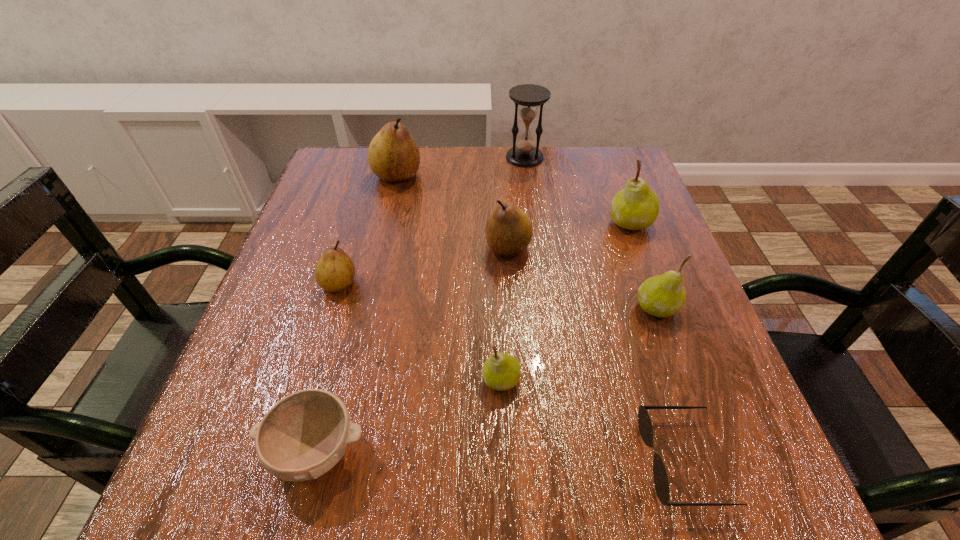
Where is `vacant region located on the right of the smallest green pear`? This screenshot has width=960, height=540. vacant region located on the right of the smallest green pear is located at coordinates (558, 380).

Image resolution: width=960 pixels, height=540 pixels. Find the location of `free space located on the right of the bowl`. free space located on the right of the bowl is located at coordinates (482, 451).

You are a GUI agent. You are given a task and a screenshot of the screen. Output one action in this format:
    pyautogui.click(x=<x>, y=<y>)
    Task: Click on the vacant position located 0.070m on the front-facing side of the black sunglasses
    
    Given the screenshot: What is the action you would take?
    pyautogui.click(x=595, y=461)

Locate an element on the screen. The width and height of the screenshot is (960, 540). blank area located on the front-facing side of the black sunglasses is located at coordinates (574, 461).

You are a GUI agent. You are given a task and a screenshot of the screen. Output one action in this format:
    pyautogui.click(x=<x>, y=<y>)
    Task: Click on the vacant region located 0.090m on the front-facing side of the black sunglasses
    
    Given the screenshot: What is the action you would take?
    pyautogui.click(x=581, y=461)

Image resolution: width=960 pixels, height=540 pixels. I want to click on hourglass at the far edge, so click(525, 153).

I want to click on pear present at the far edge, so click(393, 155).

Locate an element on the screen. bowl located in the near edge section of the desktop is located at coordinates (304, 435).

Where is `sunglasses present at the near edge`? The image size is (960, 540). sunglasses present at the near edge is located at coordinates (661, 483).

Find the location of a particular element. The height and width of the screenshot is (540, 960). bowl that is at the left edge is located at coordinates (304, 435).